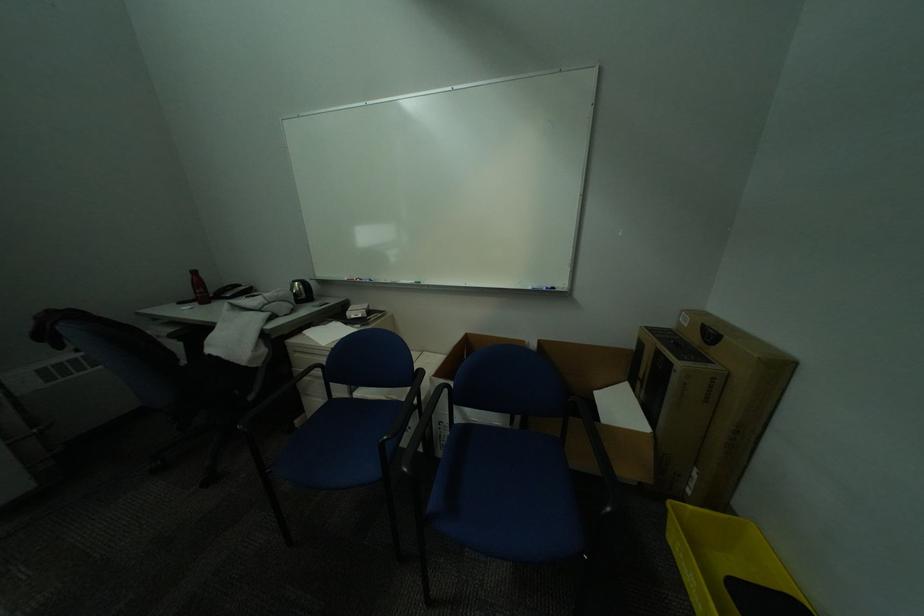
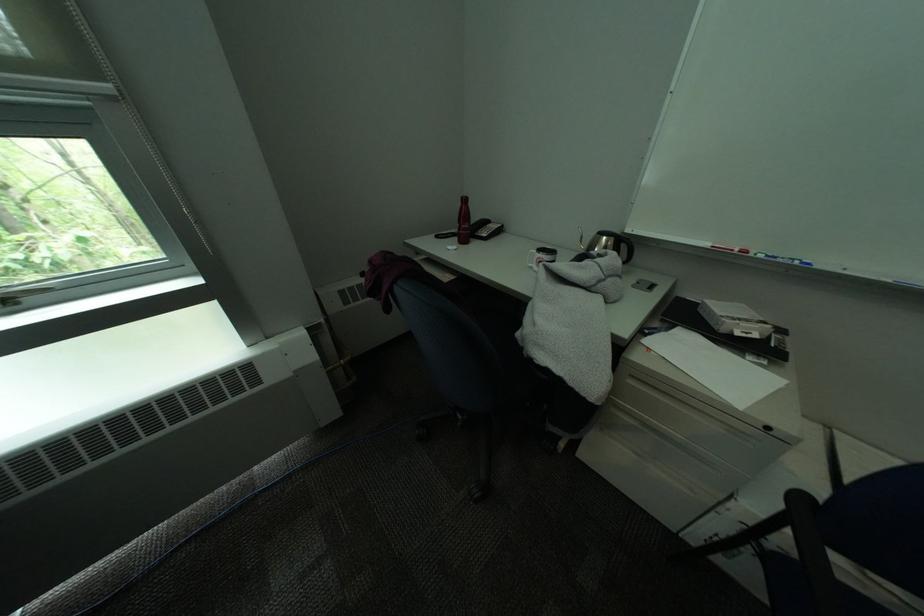
Locate, in the second image, the point that corresponds to point (281, 302) in the first image.

(615, 274)